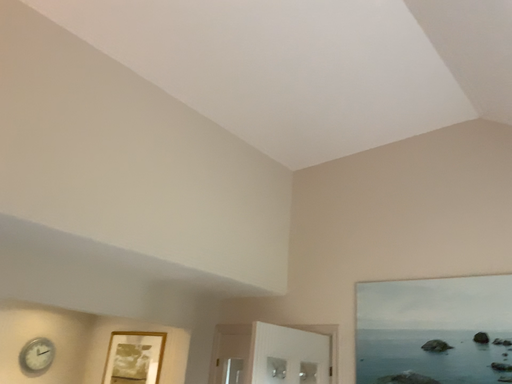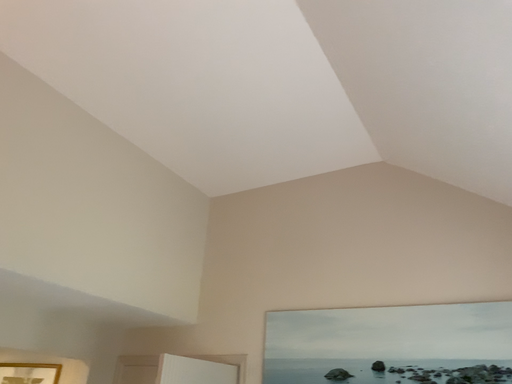
Question: How did the camera likely rotate when shooting the video?

Choices:
 (A) rotated left
 (B) rotated right

Answer: (B)